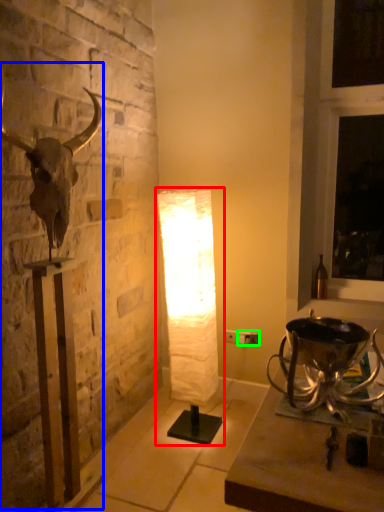
Question: Considering the real-world distances, which object is farthest from lamp (highlighted by a red box)? sculpture (highlighted by a blue box) or electric outlet (highlighted by a green box)?

Choices:
 (A) sculpture
 (B) electric outlet

Answer: (A)